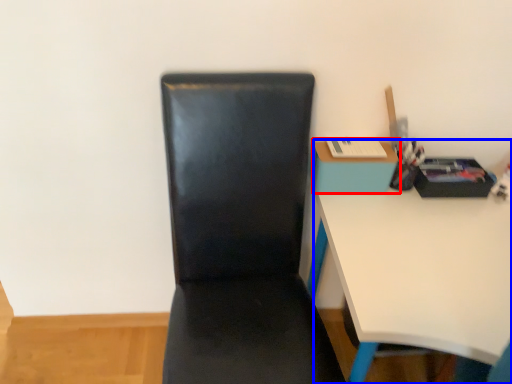
Question: Which of the following is the farthest to the observer, table (highlighted by a red box) or desk (highlighted by a blue box)?

Choices:
 (A) table
 (B) desk

Answer: (A)